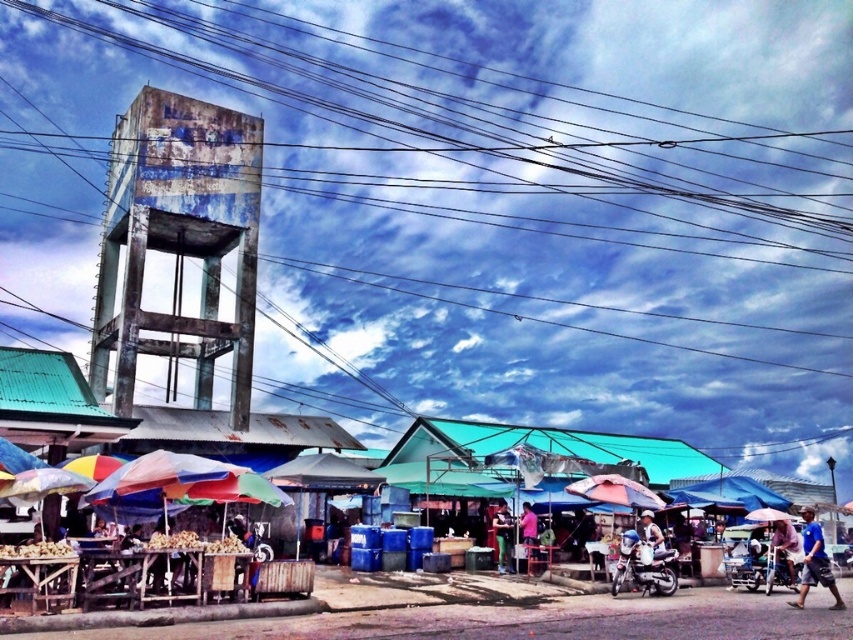
Question: Does blue fabric canopy at center appear over pink fabric umbrella at center?

Choices:
 (A) yes
 (B) no

Answer: (A)

Question: Where is rusty metal power lines at upper center located in relation to teal fabric canopy at center in the image?

Choices:
 (A) left
 (B) right

Answer: (A)

Question: Which point appears farthest from the camera in this image?

Choices:
 (A) (523, 502)
 (B) (355, 604)
 (C) (503, 538)
 (D) (675, 474)

Answer: (D)

Question: Considering the real-world distances, which object is closest to the blue fabric umbrella at lower right?

Choices:
 (A) blue fabric canopy at center
 (B) pink fabric umbrella at center

Answer: (B)

Question: Is rusty metal power lines at upper center thinner than pink fabric umbrella at center?

Choices:
 (A) no
 (B) yes

Answer: (A)

Question: Considering the real-world distances, which object is closest to the rusty metal power lines at upper center?

Choices:
 (A) wooden tables at lower left
 (B) teal fabric canopy at center
 (C) pink fabric umbrella at center
 (D) blue fabric umbrella at lower right

Answer: (B)